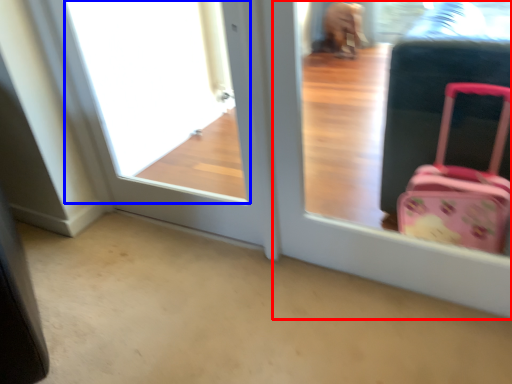
Question: Which object is closer to the camera taking this photo, screen door (highlighted by a red box) or window frame (highlighted by a blue box)?

Choices:
 (A) screen door
 (B) window frame

Answer: (A)